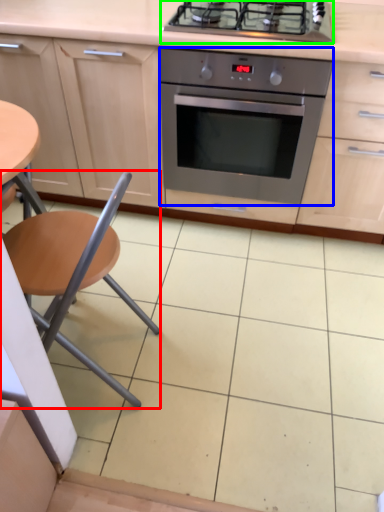
Question: Which object is positioned farthest from chair (highlighted by a red box)? Select from kitchen appliance (highlighted by a blue box) and gas stove (highlighted by a green box).

Choices:
 (A) kitchen appliance
 (B) gas stove

Answer: (B)